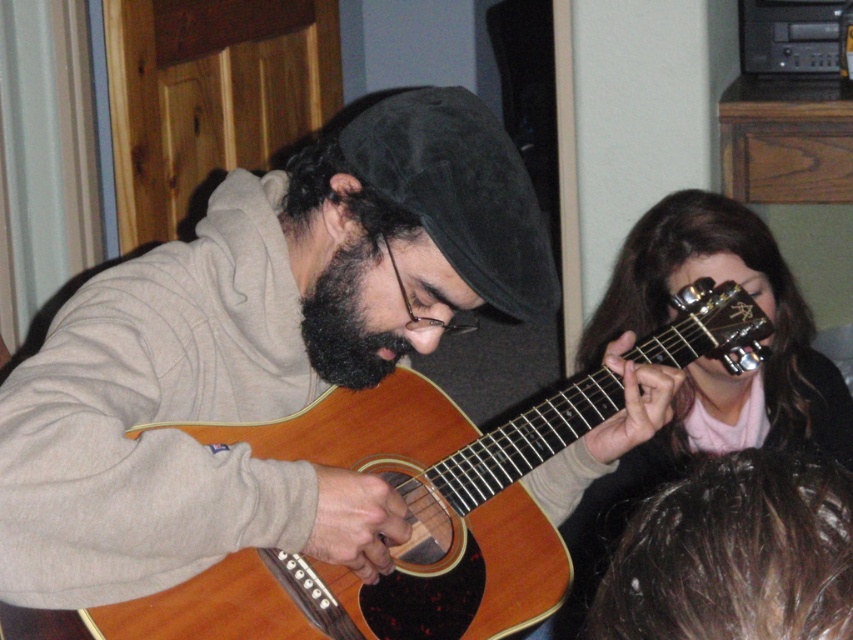
Can you confirm if wooden acoustic guitar at center is positioned above dark brown fuzzy beard at center?

No.

Is wooden acoustic guitar at center bigger than dark brown fuzzy beard at center?

Indeed, wooden acoustic guitar at center has a larger size compared to dark brown fuzzy beard at center.

This screenshot has width=853, height=640. I want to click on wooden acoustic guitar at center, so [399, 545].

Identify the location of matte black guitar at upper right. Image resolution: width=853 pixels, height=640 pixels. click(701, 369).

Does matte black guitar at upper right have a greater height compared to dark brown fuzzy beard at center?

Yes, matte black guitar at upper right is taller than dark brown fuzzy beard at center.

At what (x,y) coordinates should I click in order to perform the action: click on matte black guitar at upper right. Please return your answer as a coordinate pair (x, y). This screenshot has height=640, width=853. Looking at the image, I should click on (701, 369).

This screenshot has height=640, width=853. Identify the location of matte black guitar at upper right. (701, 369).

Between wooden acoustic guitar at center and matte black guitar at upper right, which one is positioned lower?

matte black guitar at upper right

Who is higher up, wooden acoustic guitar at center or matte black guitar at upper right?

wooden acoustic guitar at center

I want to click on wooden acoustic guitar at center, so [399, 545].